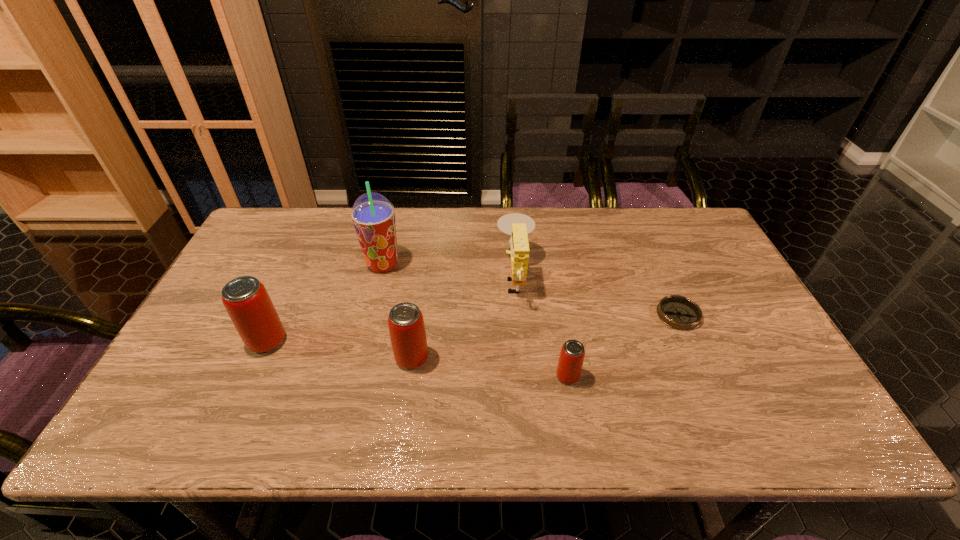
Please show where to add a beer can on the right while keeping spacing even. Please provide its 2D coordinates. Your answer should be formatted as a tuple, i.e. [(x, y)], where the tuple contains the x and y coordinates of a point satisfying the conditions above.

[(735, 396)]